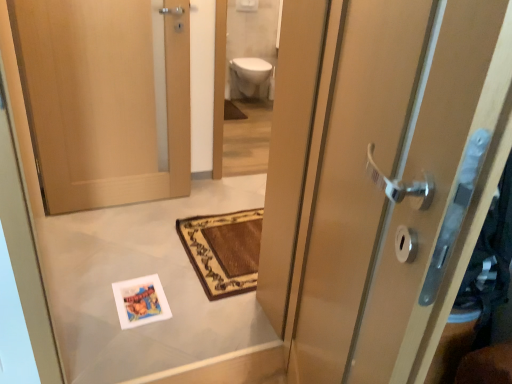
Question: Should I look upward or downward to see white glossy toilet bowl at upper center?

Choices:
 (A) down
 (B) up

Answer: (B)

Question: Considering the relative sizes of white glossy toilet bowl at upper center and matte wood door at right, the 2th door when ordered from left to right, in the image provided, is white glossy toilet bowl at upper center bigger than matte wood door at right, the 2th door when ordered from left to right,?

Choices:
 (A) no
 (B) yes

Answer: (A)

Question: From the image's perspective, does white glossy toilet bowl at upper center appear higher than matte wood door at right, the 1th door when ordered from front to back?

Choices:
 (A) yes
 (B) no

Answer: (A)

Question: Is white glossy toilet bowl at upper center outside of matte wood door at right, marked as the second door in a back-to-front arrangement?

Choices:
 (A) yes
 (B) no

Answer: (A)

Question: Is white glossy toilet bowl at upper center at the left side of matte wood door at right, marked as the second door in a back-to-front arrangement?

Choices:
 (A) no
 (B) yes

Answer: (B)

Question: From the image's perspective, does white glossy toilet bowl at upper center appear lower than matte wood door at right, the 1th door when ordered from front to back?

Choices:
 (A) no
 (B) yes

Answer: (A)

Question: Is matte wood door at right, the first door from the right, completely or partially inside white glossy toilet bowl at upper center?

Choices:
 (A) yes
 (B) no

Answer: (B)

Question: Does white glossy toilet bowl at upper center have a greater width compared to white glossy toilet at upper center?

Choices:
 (A) no
 (B) yes

Answer: (B)

Question: Could you tell me if white glossy toilet bowl at upper center is facing white glossy toilet at upper center?

Choices:
 (A) yes
 (B) no

Answer: (A)

Question: Is white glossy toilet bowl at upper center positioned in front of white glossy toilet at upper center?

Choices:
 (A) no
 (B) yes

Answer: (A)

Question: Considering the relative positions of white glossy toilet bowl at upper center and white glossy toilet at upper center in the image provided, is white glossy toilet bowl at upper center to the left of white glossy toilet at upper center from the viewer's perspective?

Choices:
 (A) no
 (B) yes

Answer: (B)

Question: Is white glossy toilet bowl at upper center smaller than white glossy toilet at upper center?

Choices:
 (A) no
 (B) yes

Answer: (B)

Question: Is white glossy toilet bowl at upper center beside white glossy toilet at upper center?

Choices:
 (A) no
 (B) yes

Answer: (A)

Question: From the image's perspective, is white glossy toilet at upper center beneath white glossy toilet bowl at upper center?

Choices:
 (A) yes
 (B) no

Answer: (A)